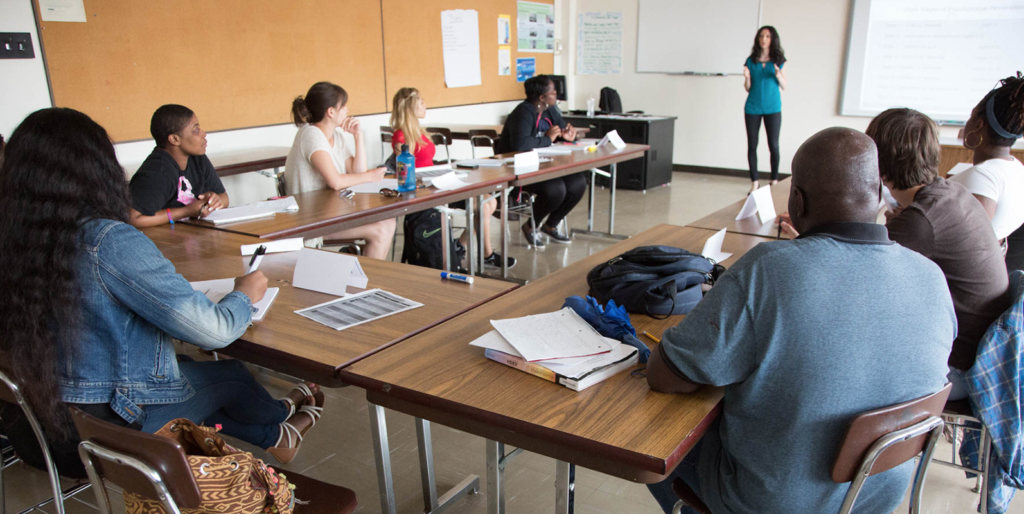
Locate an element on the screen. Image resolution: width=1024 pixels, height=514 pixels. bulletin board is located at coordinates (174, 36), (430, 36).